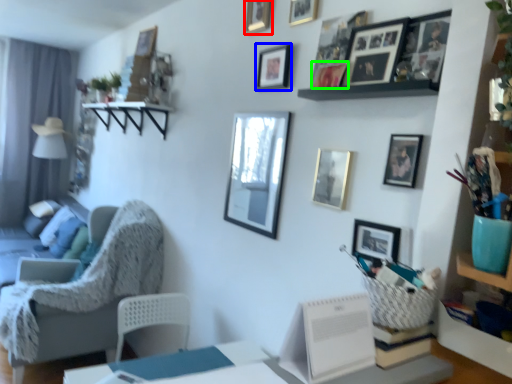
Question: Estimate the real-world distances between objects in this image. Which object is closer to picture frame (highlighted by a red box), picture frame (highlighted by a blue box) or picture frame (highlighted by a green box)?

Choices:
 (A) picture frame
 (B) picture frame

Answer: (A)